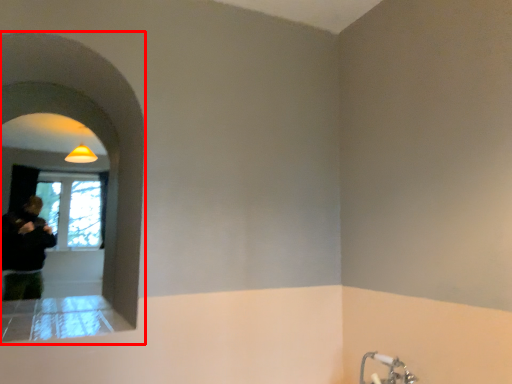
Question: Where is archway (annotated by the red box) located in relation to tap in the image?

Choices:
 (A) left
 (B) right

Answer: (A)